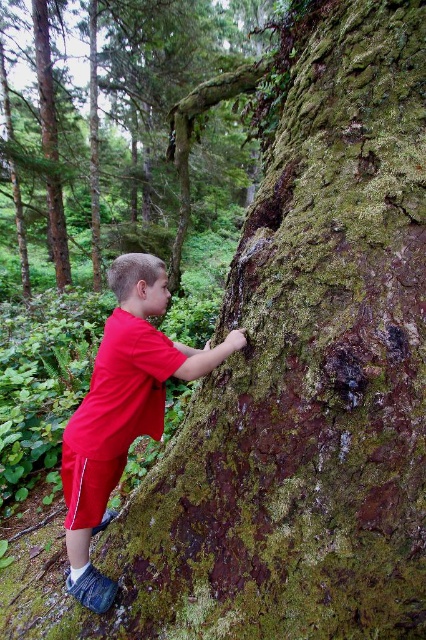
Question: Which point appears farthest from the camera in this image?

Choices:
 (A) (109, 404)
 (B) (115, 4)

Answer: (B)

Question: Which point appears closest to the camera in this image?

Choices:
 (A) (163, 163)
 (B) (108, 380)

Answer: (B)

Question: Does green mossy tree trunk at center appear over matte red shorts at lower left?

Choices:
 (A) yes
 (B) no

Answer: (A)

Question: Is green mossy tree trunk at center in front of matte red shorts at lower left?

Choices:
 (A) yes
 (B) no

Answer: (B)

Question: Which of the following is the closest to the observer?

Choices:
 (A) (175, 342)
 (B) (77, 152)

Answer: (A)

Question: Is green mossy tree trunk at center below matte red shorts at lower left?

Choices:
 (A) yes
 (B) no

Answer: (B)